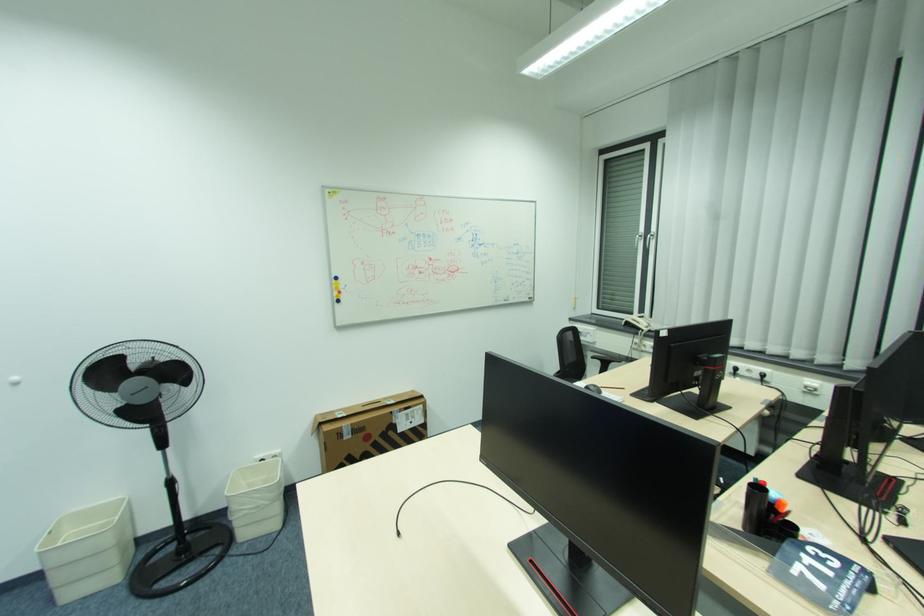
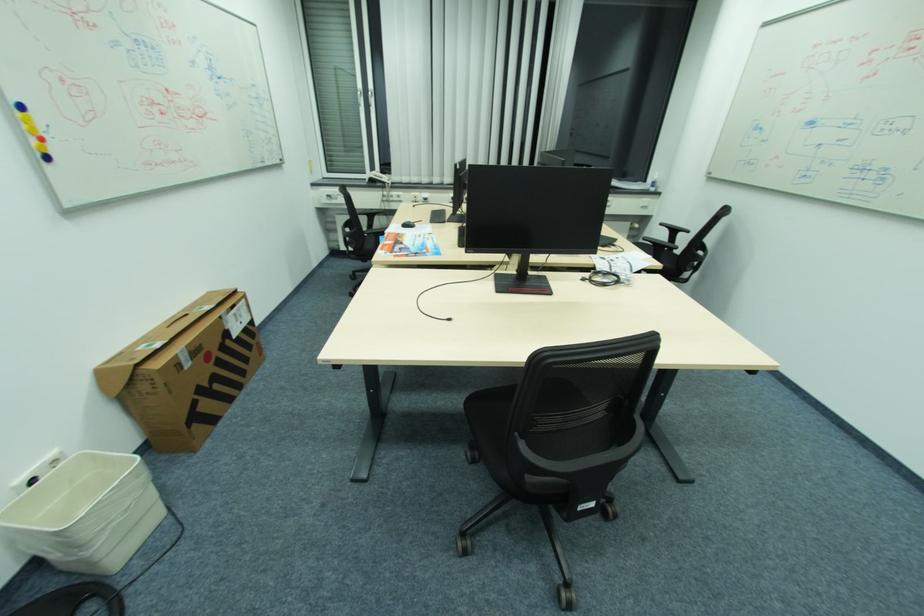
In the second image, find the point that corresponds to pixel 345 293 in the first image.

(44, 140)